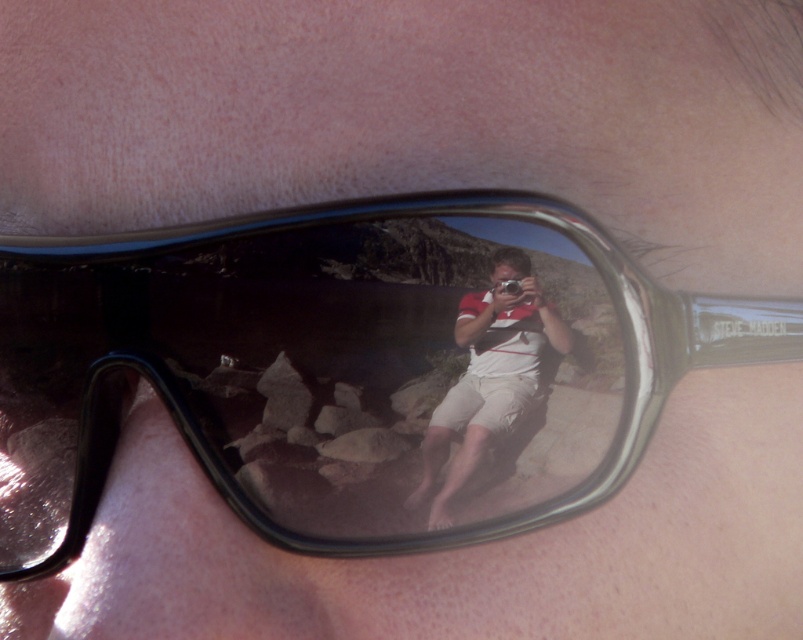
You are a photographer trying to adjust your equipment. You notice the black plastic goggles at center and the matte white shorts at center in your reflection. Which object should you adjust first if you want to focus on the one closer to you?

You should adjust the black plastic goggles at center first because it is closer to the viewer than the matte white shorts at center.

You are a photographer trying to capture the reflection in the sunglasses. You notice two points in the reflection at coordinates point [528,268] and point [467,464]. Which point is closer to your camera lens?

Point [528,268] is closer to the camera than point [467,464].

You are a photographer trying to capture the reflection in the sunglasses. You notice the black plastic goggles at center and the matte white shorts at center in the reflection. Which object is located to the left of the other?

The black plastic goggles at center is positioned on the left side of matte white shorts at center, so the black plastic goggles at center is to the left of the matte white shorts at center.